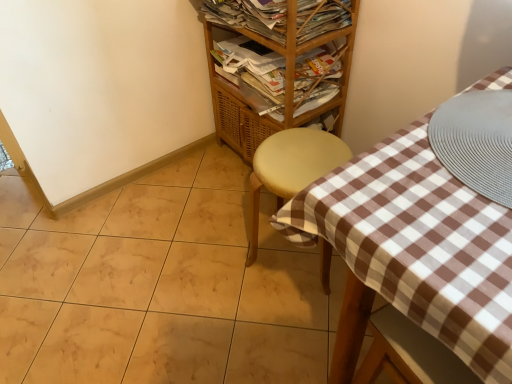
What are the coordinates of `vacant area in front of matte yellow stool at center` in the screenshot? It's located at (279, 318).